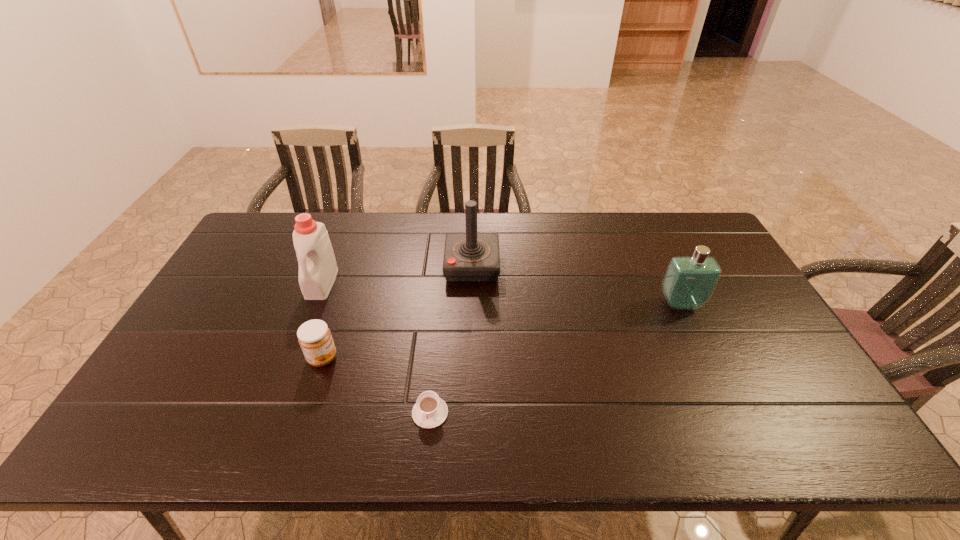
Locate an element on the screen. detergent is located at coordinates (318, 269).

You are a GUI agent. You are given a task and a screenshot of the screen. Output one action in this format:
    pyautogui.click(x=<x>, y=<y>)
    Task: Click on the joystick
    The height and width of the screenshot is (540, 960).
    Given the screenshot: What is the action you would take?
    pyautogui.click(x=471, y=257)

At what (x,y) coordinates should I click in order to perform the action: click on perfume. Please return your answer as a coordinate pair (x, y). This screenshot has height=540, width=960. Looking at the image, I should click on (689, 282).

Locate an element on the screen. the rightmost object is located at coordinates (689, 282).

At what (x,y) coordinates should I click in order to perform the action: click on the fourth tallest object. Please return your answer as a coordinate pair (x, y). The height and width of the screenshot is (540, 960). Looking at the image, I should click on (314, 337).

Locate an element on the screen. This screenshot has height=540, width=960. the fourth object from right to left is located at coordinates (314, 337).

You are a GUI agent. You are given a task and a screenshot of the screen. Output one action in this format:
    pyautogui.click(x=<x>, y=<y>)
    Task: Click on the shortest object
    This screenshot has height=540, width=960.
    Given the screenshot: What is the action you would take?
    pyautogui.click(x=430, y=411)

Where is `teacup`? This screenshot has height=540, width=960. teacup is located at coordinates (430, 411).

I want to click on vacant space located on the handle side of the leftmost object, so pyautogui.click(x=281, y=387).

Image resolution: width=960 pixels, height=540 pixels. In order to click on free space located 0.110m on the rectangular base of the joystick in this screenshot , I will do `click(533, 266)`.